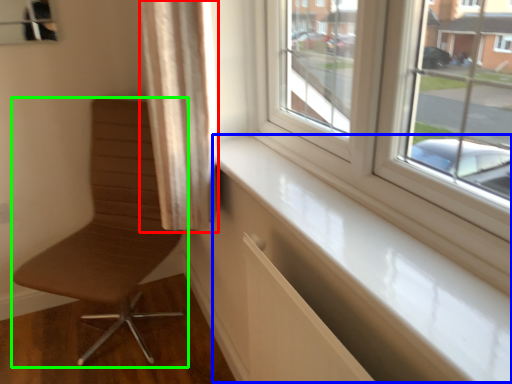
Question: Which object is the farthest from curtain (highlighted by a red box)? Choose among these: window sill (highlighted by a blue box) or chair (highlighted by a green box).

Choices:
 (A) window sill
 (B) chair

Answer: (B)